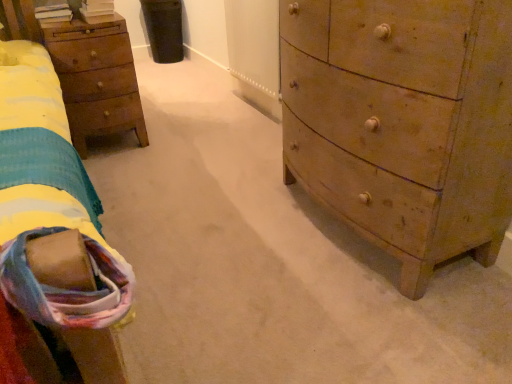
Question: Is point (120, 79) positioned closer to the camera than point (351, 28)?

Choices:
 (A) farther
 (B) closer

Answer: (A)

Question: Considering the positions of wooden nightstand at left and wooden chest of drawers at right in the image, is wooden nightstand at left wider or thinner than wooden chest of drawers at right?

Choices:
 (A) wide
 (B) thin

Answer: (B)

Question: Which object is the farthest from the wooden nightstand at left?

Choices:
 (A) soft cotton blanket at lower left
 (B) wooden chest of drawers at right

Answer: (B)

Question: Which is farther from the wooden nightstand at left?

Choices:
 (A) soft cotton blanket at lower left
 (B) wooden chest of drawers at right

Answer: (B)